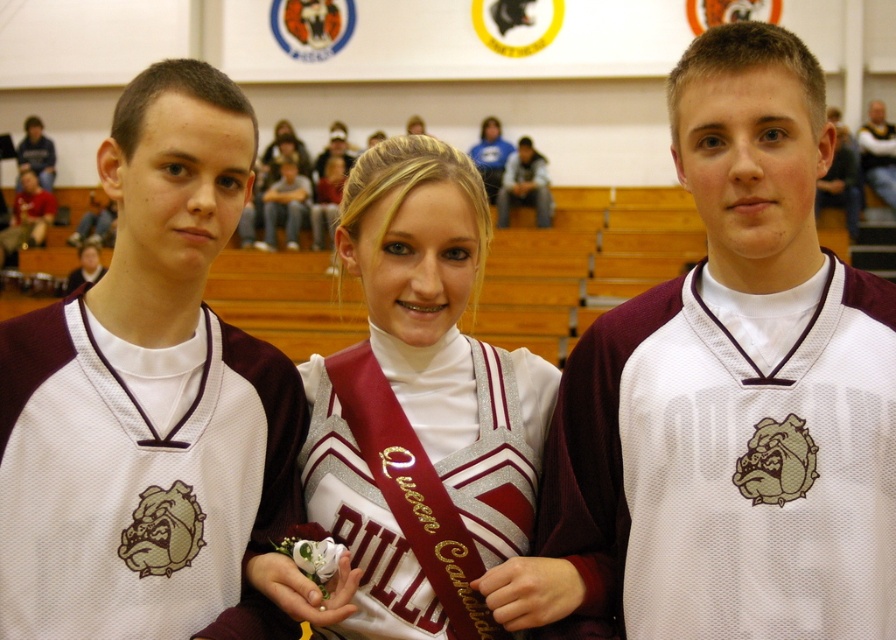
You are a photographer trying to capture a clear shot of both the white mesh jersey at center and the white satin sash at center. Which one is located lower in the image?

The white mesh jersey at center is positioned under the white satin sash at center, so the white mesh jersey at center is lower in the image.

You are a photographer at the event and need to adjust the lighting so that both the matte gray jeans at center and the white jersey at center are clearly visible. Considering their relative heights, which object should you focus on first to ensure proper exposure?

The matte gray jeans at center has a lesser height compared to white jersey at center, so you should focus on the white jersey at center first since it is taller and might require more attention to capture details properly.

You are standing at the origin point of the image coordinate system. You see two points labeled as point (308, 198) and point (886, 202). Which point is closer to you?

Point (886, 202) is closer to you because it is in front of point (308, 198).